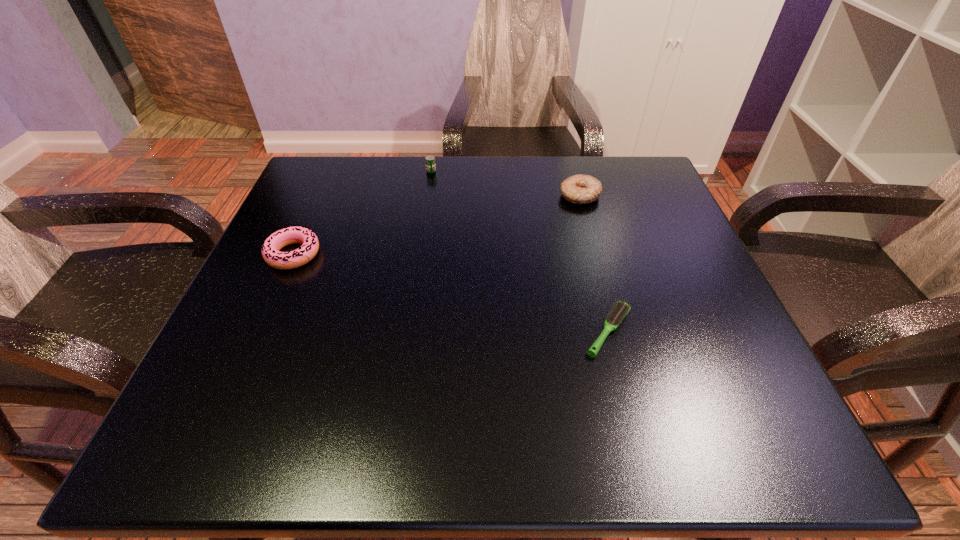
The height and width of the screenshot is (540, 960). I want to click on free point between the farthest object and the second nearest object, so click(362, 213).

I want to click on vacant space that's between the hairbrush and the leftmost object, so click(x=451, y=293).

Find the location of a particular element. The image size is (960, 540). free area in between the shortest object and the second farthest object is located at coordinates (594, 264).

Point out which object is positioned as the second nearest to the nearest object. Please provide its 2D coordinates. Your answer should be formatted as a tuple, i.e. [(x, y)], where the tuple contains the x and y coordinates of a point satisfying the conditions above.

[(429, 160)]

Point out which object is positioned as the third nearest to the farther doughnut. Please provide its 2D coordinates. Your answer should be formatted as a tuple, i.e. [(x, y)], where the tuple contains the x and y coordinates of a point satisfying the conditions above.

[(271, 247)]

Locate an element on the screen. The height and width of the screenshot is (540, 960). vacant region that satisfies the following two spatial constraints: 1. on the front side of the farther doughnut; 2. on the left side of the farthest object is located at coordinates (427, 196).

I want to click on free point that satisfies the following two spatial constraints: 1. on the back side of the farther doughnut; 2. on the left side of the leftmost object, so click(320, 196).

Locate an element on the screen. The height and width of the screenshot is (540, 960). vacant space that satisfies the following two spatial constraints: 1. on the back side of the leftmost object; 2. on the left side of the second object from left to right is located at coordinates (330, 171).

You are a GUI agent. You are given a task and a screenshot of the screen. Output one action in this format:
    pyautogui.click(x=<x>, y=<y>)
    Task: Click on the free point that satisfies the following two spatial constraints: 1. on the back side of the right doughnut; 2. on the left side of the nearer doughnut
    The height and width of the screenshot is (540, 960).
    Given the screenshot: What is the action you would take?
    pyautogui.click(x=320, y=196)